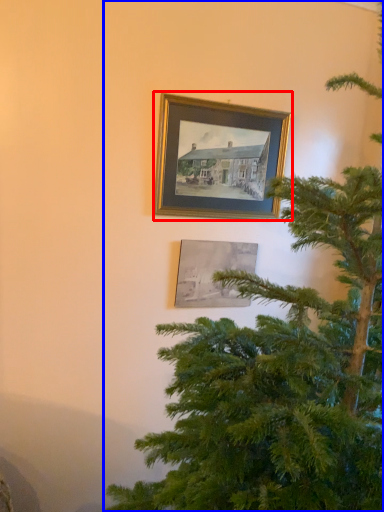
Question: Which object appears farthest to the camera in this image, picture frame (highlighted by a red box) or christmas tree (highlighted by a blue box)?

Choices:
 (A) picture frame
 (B) christmas tree

Answer: (A)